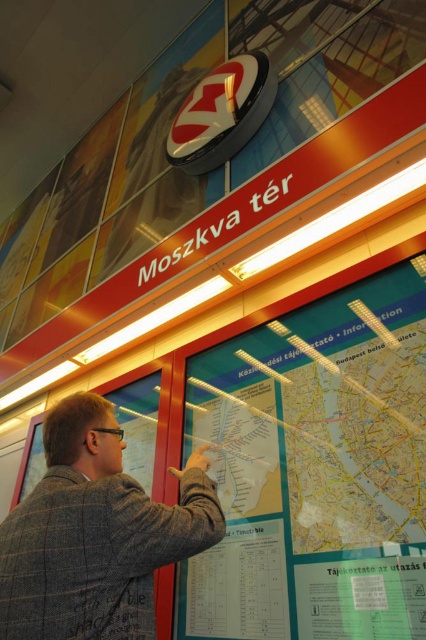
Question: Can you confirm if matte plastic map at center is bigger than gray woolen jacket at center?

Choices:
 (A) no
 (B) yes

Answer: (B)

Question: Is matte plastic map at center to the right of gray woolen jacket at center from the viewer's perspective?

Choices:
 (A) no
 (B) yes

Answer: (B)

Question: Is matte plastic map at center positioned at the back of gray woolen jacket at center?

Choices:
 (A) yes
 (B) no

Answer: (A)